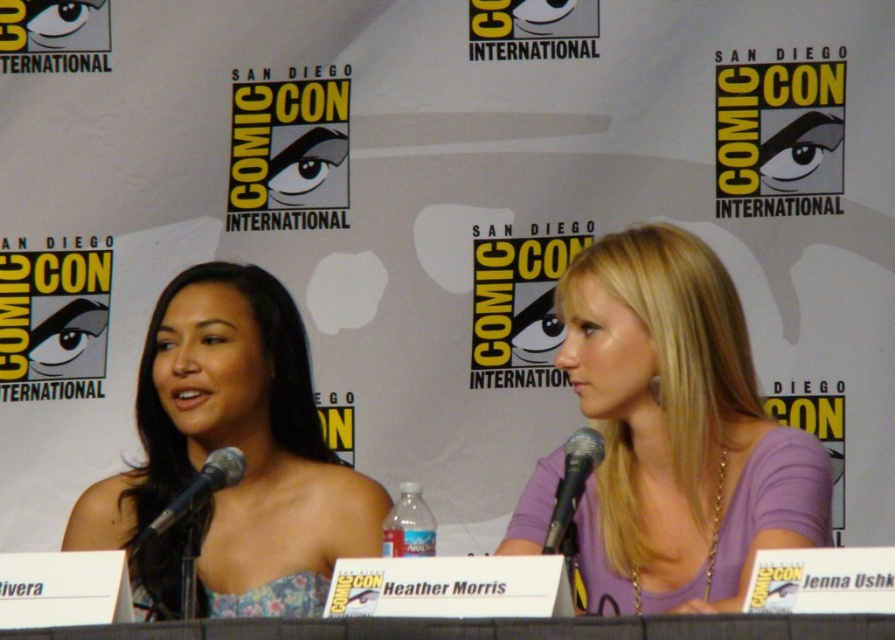
Question: Can you confirm if black metallic microphone at left is wider than black metallic microphone at lower center?

Choices:
 (A) no
 (B) yes

Answer: (B)

Question: Which object is farther from the camera taking this photo?

Choices:
 (A) floral fabric dress at left
 (B) purple fabric shirt at center
 (C) black metallic microphone at lower center
 (D) black metallic microphone at left

Answer: (A)

Question: Can you confirm if black metallic microphone at left is thinner than black metallic microphone at lower center?

Choices:
 (A) no
 (B) yes

Answer: (A)

Question: Is floral fabric dress at left bigger than black metallic microphone at left?

Choices:
 (A) no
 (B) yes

Answer: (B)

Question: Which point is closer to the camera?

Choices:
 (A) purple fabric shirt at center
 (B) black metallic microphone at lower center

Answer: (B)

Question: Which is nearer to the black metallic microphone at lower center?

Choices:
 (A) purple fabric shirt at center
 (B) floral fabric dress at left

Answer: (A)